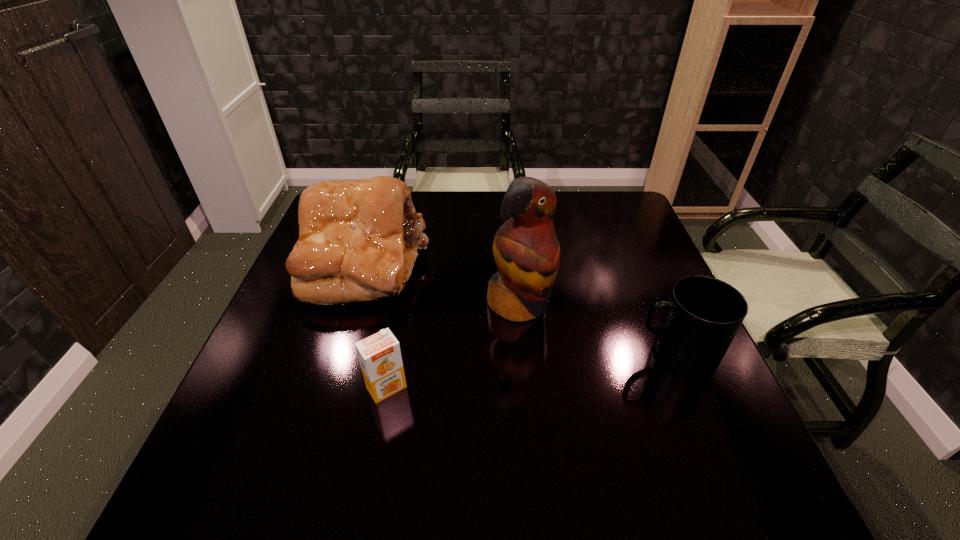
In the image, there is a desktop. Where is `free space at the near edge`? free space at the near edge is located at coordinates (644, 428).

At what (x,y) coordinates should I click in order to perform the action: click on vacant space at the left edge of the desktop. Please return your answer as a coordinate pair (x, y). This screenshot has width=960, height=540. Looking at the image, I should click on [328, 311].

Find the location of a particular element. This screenshot has width=960, height=540. free space at the right edge of the desktop is located at coordinates (629, 279).

Identify the location of vacant region at the far right corner of the desktop. The image size is (960, 540). (599, 221).

Locate an element on the screen. The image size is (960, 540). vacant space that's between the third object from left to right and the orange juice is located at coordinates (453, 346).

Identify the location of free space between the second tallest object and the orange juice. This screenshot has width=960, height=540. (374, 326).

Identify the location of free space between the third object from left to right and the mug. (597, 329).

You are a GUI agent. You are given a task and a screenshot of the screen. Output one action in this format:
    pyautogui.click(x=<x>, y=<y>)
    Task: Click on the free space between the mug and the orange juice
    This screenshot has height=540, width=960.
    Given the screenshot: What is the action you would take?
    pyautogui.click(x=531, y=370)

Find the location of a particular element. This screenshot has height=540, width=960. free space between the bread and the orange juice is located at coordinates (374, 326).

Locate an element on the screen. This screenshot has width=960, height=540. free space between the mug and the orange juice is located at coordinates (531, 370).